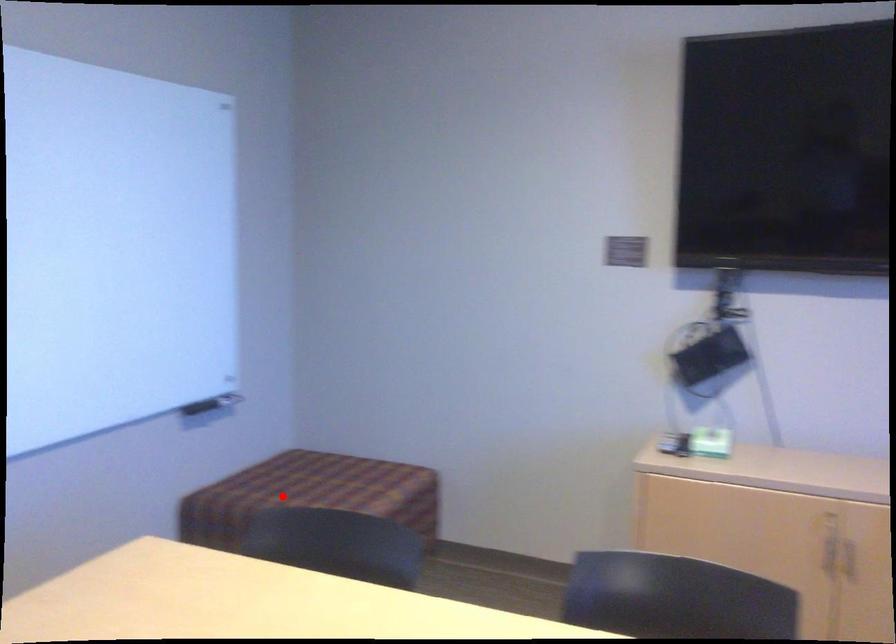
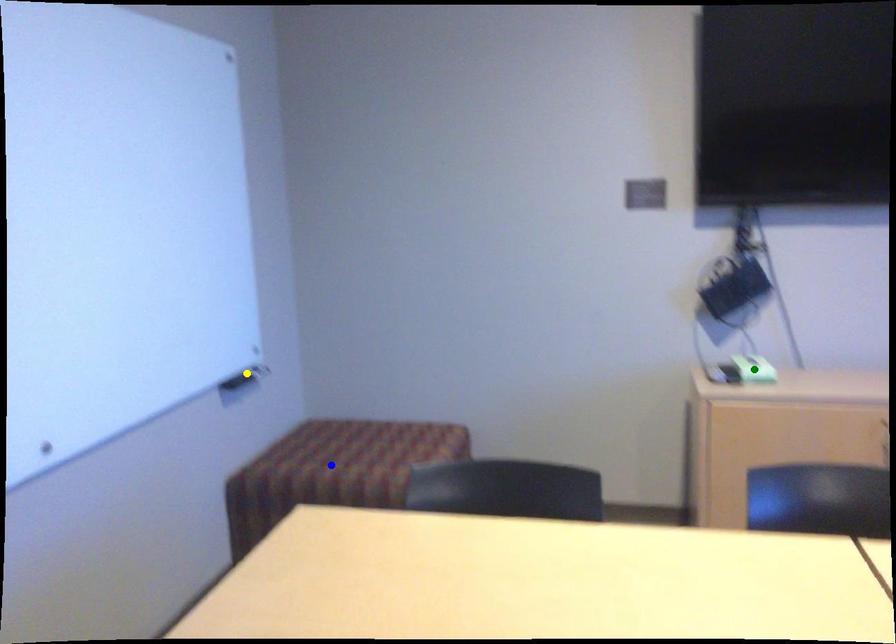
Question: I am providing you with two images of the same scene from different viewpoints. A red point is marked on the first image. You are given multiple points on the second image. Which point in image 2 is actually the same real-world point as the red point in image 1?

Choices:
 (A) green point
 (B) yellow point
 (C) blue point

Answer: (C)